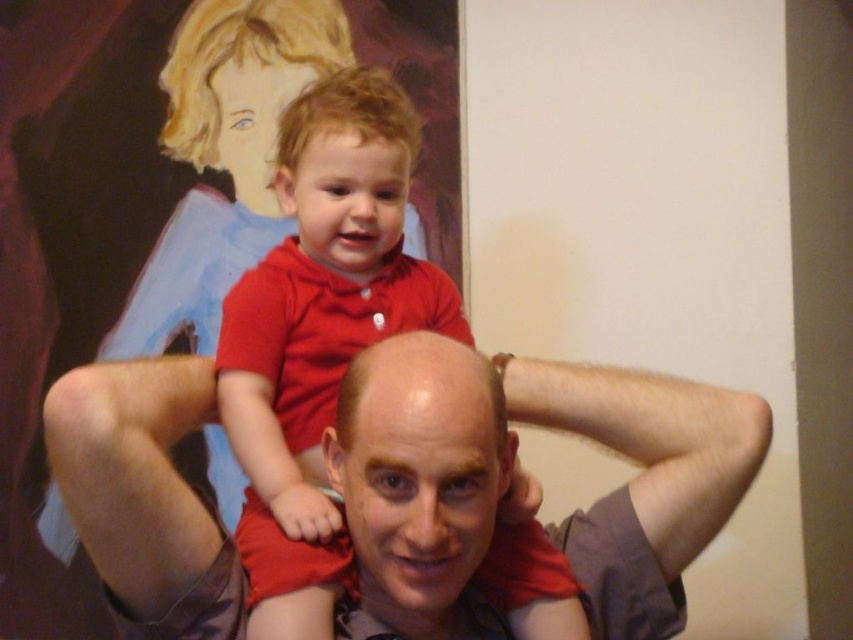
Question: Does smooth gray shirt at center appear on the right side of smooth bald head at center?

Choices:
 (A) no
 (B) yes

Answer: (B)

Question: Which object is closer to the camera taking this photo?

Choices:
 (A) smooth bald head at center
 (B) red matte shirt at upper center
 (C) smooth gray shirt at center

Answer: (A)

Question: Which point is farther to the camera?

Choices:
 (A) matte red shirt at center
 (B) red matte shirt at upper center
 (C) smooth gray shirt at center

Answer: (A)

Question: Can you confirm if red matte shirt at upper center is positioned above smooth bald head at center?

Choices:
 (A) yes
 (B) no

Answer: (A)

Question: Is red matte shirt at upper center below matte red shirt at center?

Choices:
 (A) yes
 (B) no

Answer: (A)

Question: Which of the following is the closest to the observer?

Choices:
 (A) red matte shirt at upper center
 (B) smooth bald head at center
 (C) smooth gray shirt at center

Answer: (B)